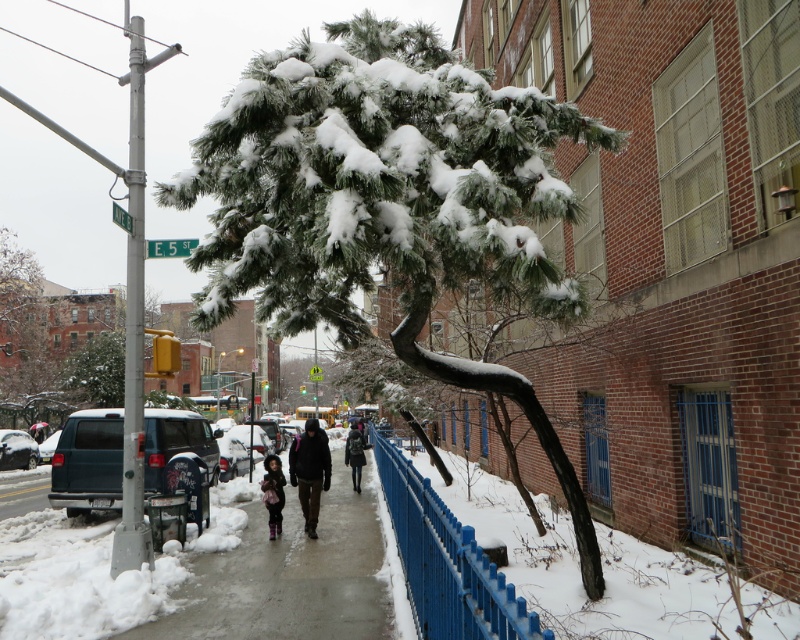
Is dark brown fur coat at center closer to the viewer compared to dark gray fabric coat at center?

Yes.

Looking at this image, is dark brown fur coat at center to the right of dark gray fabric coat at center from the viewer's perspective?

Correct, you'll find dark brown fur coat at center to the right of dark gray fabric coat at center.

Find the location of a particular element. This screenshot has width=800, height=640. dark brown fur coat at center is located at coordinates (274, 492).

Measure the distance between point (476, 134) and camera.

Point (476, 134) is 4.51 meters away from camera.

Does green snow-covered tree at center have a lesser width compared to smooth concrete sidewalk at center?

In fact, green snow-covered tree at center might be wider than smooth concrete sidewalk at center.

Which is behind, point (498, 152) or point (316, 586)?

Point (316, 586)

Find the location of a particular element. green snow-covered tree at center is located at coordinates (388, 200).

Which of these two, green snow-covered tree at center or dark brown leather jacket at center, stands shorter?

dark brown leather jacket at center

Does green snow-covered tree at center have a greater width compared to dark brown leather jacket at center?

Yes.

What do you see at coordinates (388, 200) in the screenshot?
I see `green snow-covered tree at center` at bounding box center [388, 200].

Identify the location of green snow-covered tree at center. The image size is (800, 640). (388, 200).